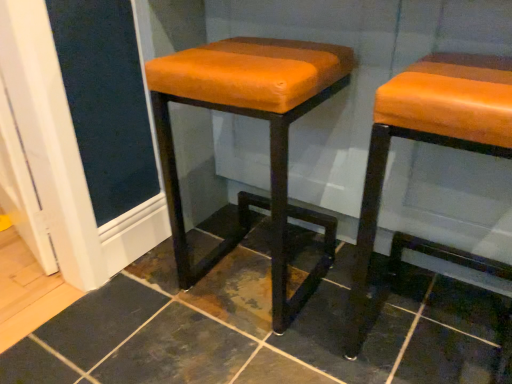
You are a GUI agent. You are given a task and a screenshot of the screen. Output one action in this format:
    pyautogui.click(x=<x>, y=<y>)
    Task: Click on the vacant area situated to the left side of orange leather stool at center, which ranks as the first stool in left-to-right order
    This screenshot has width=512, height=384.
    Given the screenshot: What is the action you would take?
    pyautogui.click(x=139, y=301)